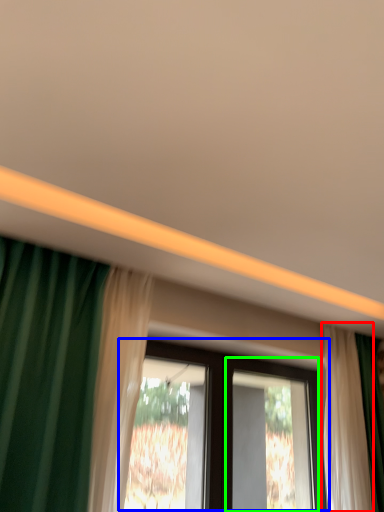
Question: Which is farther away from curtain (highlighted by a red box)? window (highlighted by a blue box) or screen door (highlighted by a green box)?

Choices:
 (A) window
 (B) screen door

Answer: (B)